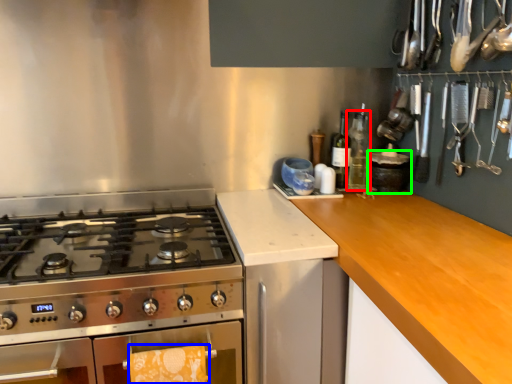
Question: Considering the real-world distances, which object is farthest from bottle (highlighted by a red box)? hand towel (highlighted by a blue box) or kitchen appliance (highlighted by a green box)?

Choices:
 (A) hand towel
 (B) kitchen appliance

Answer: (A)